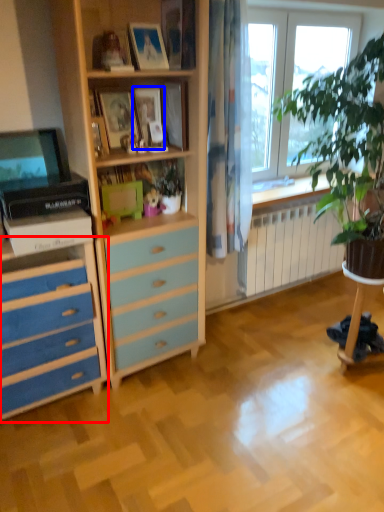
Question: Which object is further to the camera taking this photo, chest of drawers (highlighted by a red box) or picture frame (highlighted by a blue box)?

Choices:
 (A) chest of drawers
 (B) picture frame

Answer: (B)